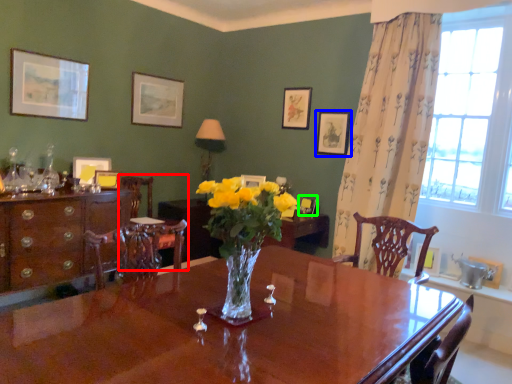
Question: Which object is positioned closest to chair (highlighted by a red box)? Select from picture frame (highlighted by a blue box) and picture frame (highlighted by a green box).

Choices:
 (A) picture frame
 (B) picture frame

Answer: (B)